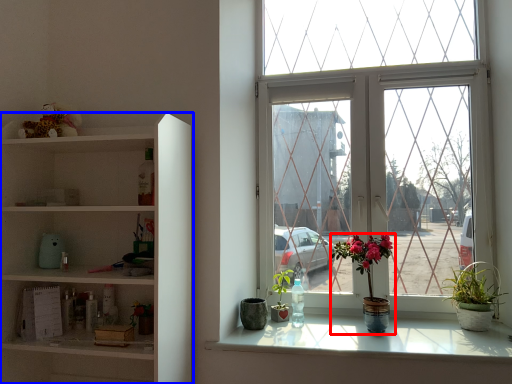
Question: Which object appears closest to the camera in this image, houseplant (highlighted by a red box) or shelf (highlighted by a blue box)?

Choices:
 (A) houseplant
 (B) shelf

Answer: (B)